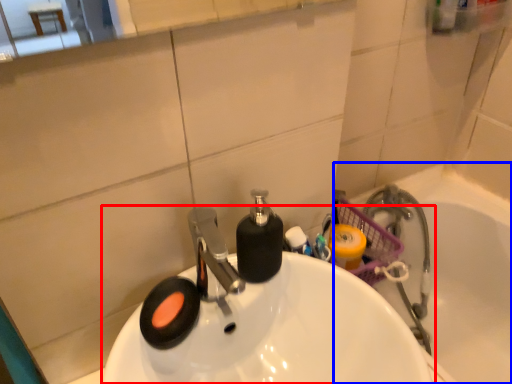
Question: Among these objects, which one is nearest to the camera, sink (highlighted by a red box) or bath (highlighted by a blue box)?

Choices:
 (A) sink
 (B) bath

Answer: (A)